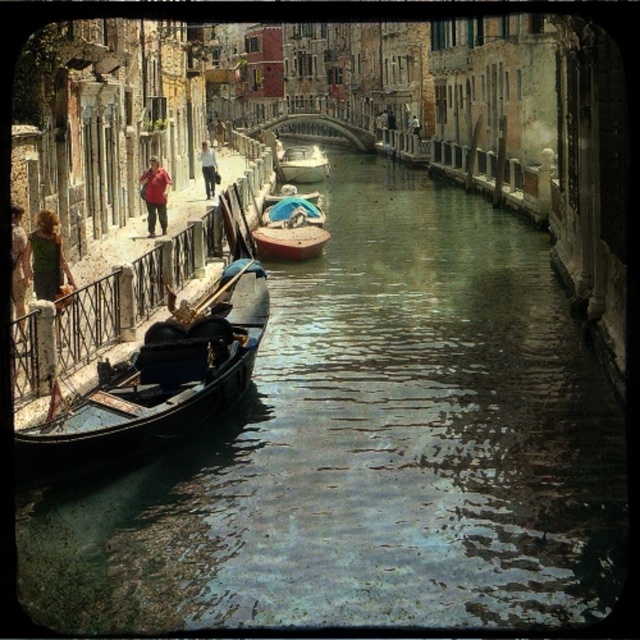
Between red cotton shirt at left and light brown leather jacket at upper left, which one is positioned higher?

light brown leather jacket at upper left is above.

Between point (166, 177) and point (209, 186), which one is positioned behind?

The point (209, 186) is behind.

Locate an element on the screen. The width and height of the screenshot is (640, 640). red cotton shirt at left is located at coordinates (154, 195).

Which is in front, point (273, 244) or point (205, 156)?

Point (273, 244) is in front.

Between blue fabric-covered boat at center and light brown leather jacket at upper left, which one appears on the left side from the viewer's perspective?

light brown leather jacket at upper left is more to the left.

Is point (268, 248) less distant than point (208, 154)?

Yes, it is in front of point (208, 154).

Locate an element on the screen. blue fabric-covered boat at center is located at coordinates (291, 230).

Is point (307, 257) in front of point (36, 221)?

No, (307, 257) is behind (36, 221).

Who is taller, blue fabric-covered boat at center or green fabric shirt at left?

blue fabric-covered boat at center

Is point (280, 198) closer to viewer compared to point (67, 272)?

No, (280, 198) is further to viewer.

Identify the location of blue fabric-covered boat at center. This screenshot has height=640, width=640. (291, 230).